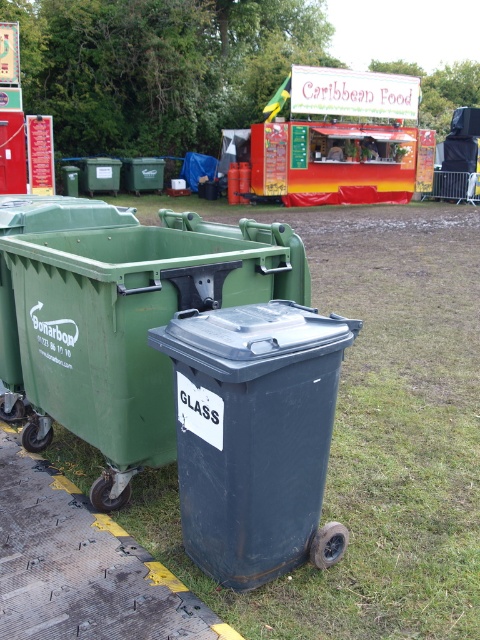
Question: Is green grass at lower right closer to the viewer compared to caribbean food cart at center?

Choices:
 (A) yes
 (B) no

Answer: (A)

Question: Is green grass at lower right positioned at the back of matte black bin at center?

Choices:
 (A) yes
 (B) no

Answer: (B)

Question: Can you confirm if matte black bin at center is smaller than matte gray bin at center?

Choices:
 (A) yes
 (B) no

Answer: (B)

Question: Which of the following is the farthest from the observer?

Choices:
 (A) (327, 476)
 (B) (305, 10)
 (C) (189, 552)
 (D) (24, 390)

Answer: (B)

Question: Which point is farther from the camera taking this photo?

Choices:
 (A) (309, 452)
 (B) (384, 518)

Answer: (B)

Question: Which point is farther to the camera?

Choices:
 (A) matte gray bin at center
 (B) caribbean food cart at center
 (C) green grass at lower right
 (D) matte black bin at center

Answer: (B)